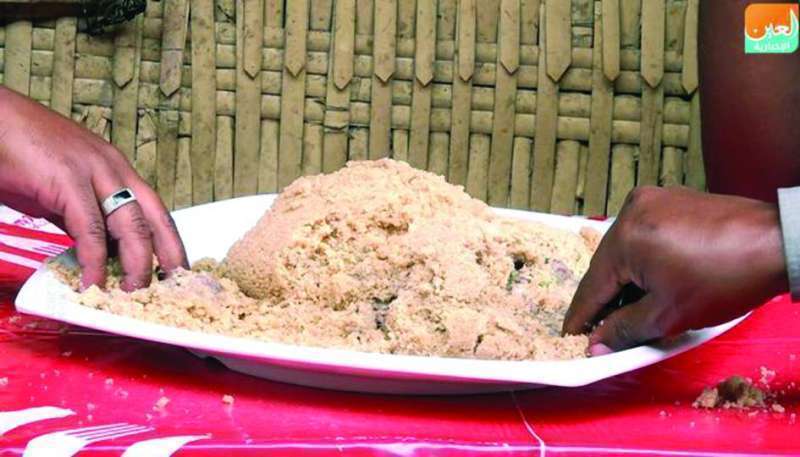
Locate an element on the screen. Image resolution: width=800 pixels, height=457 pixels. food spill is located at coordinates (746, 391).